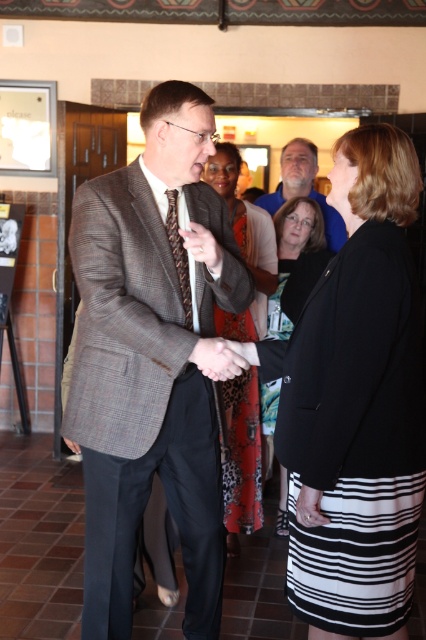
Can you confirm if plaid wool suit at center is shorter than black textured skirt at center?

In fact, plaid wool suit at center may be taller than black textured skirt at center.

Between point (206, 275) and point (322, 563), which one is positioned behind?

The point (206, 275) is more distant.

Locate an element on the screen. plaid wool suit at center is located at coordinates (149, 364).

Does black satin blazer at center lie behind matte brown suit at center?

No.

Is point (313, 257) farther from camera compared to point (310, 195)?

No, it is not.

This screenshot has width=426, height=640. What are the coordinates of `black satin blazer at center` in the screenshot? It's located at (296, 260).

Between black textured skirt at center and matte brown suit at center, which one has more height?

Standing taller between the two is black textured skirt at center.

Based on the photo, does black textured skirt at center appear on the left side of matte brown suit at center?

Yes, black textured skirt at center is to the left of matte brown suit at center.

What do you see at coordinates (356, 404) in the screenshot? I see `black textured skirt at center` at bounding box center [356, 404].

Find the location of a particular element. The image size is (426, 640). black textured skirt at center is located at coordinates (356, 404).